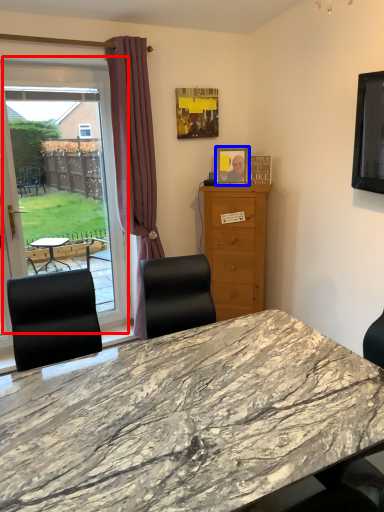
Question: Among these objects, which one is nearest to the camera, window (highlighted by a red box) or picture frame (highlighted by a blue box)?

Choices:
 (A) window
 (B) picture frame

Answer: (A)